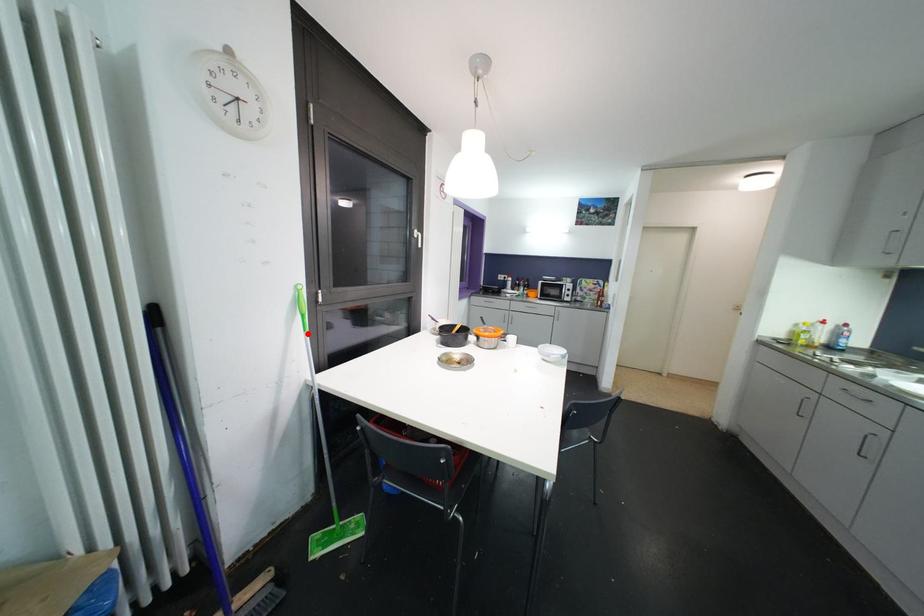
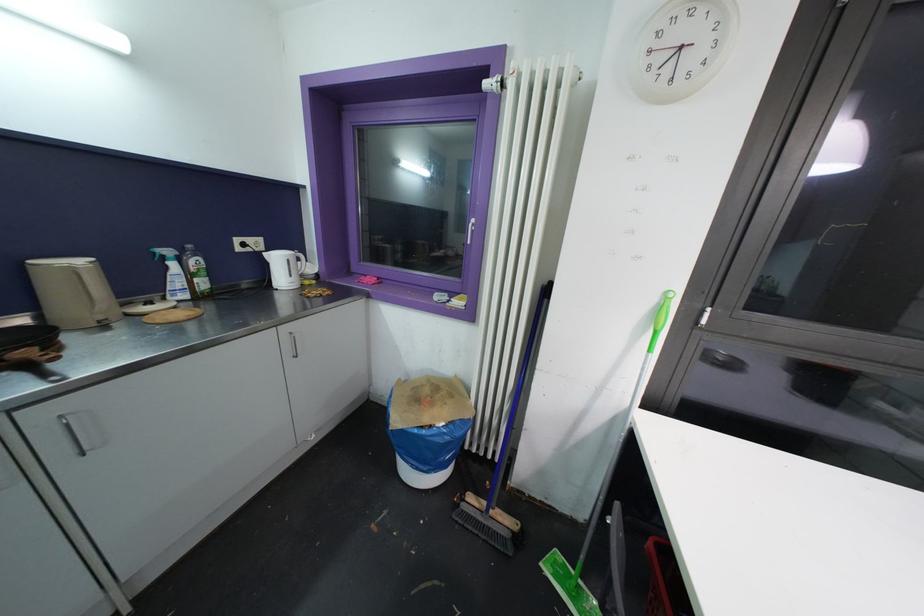
Question: I am providing you with two images of the same scene from different viewpoints. Image1 has a red point marked. In image2, the corresponding 3D location appears at what relative position? Reply with the corresponding letter.

Choices:
 (A) Closer
 (B) Farther

Answer: (B)